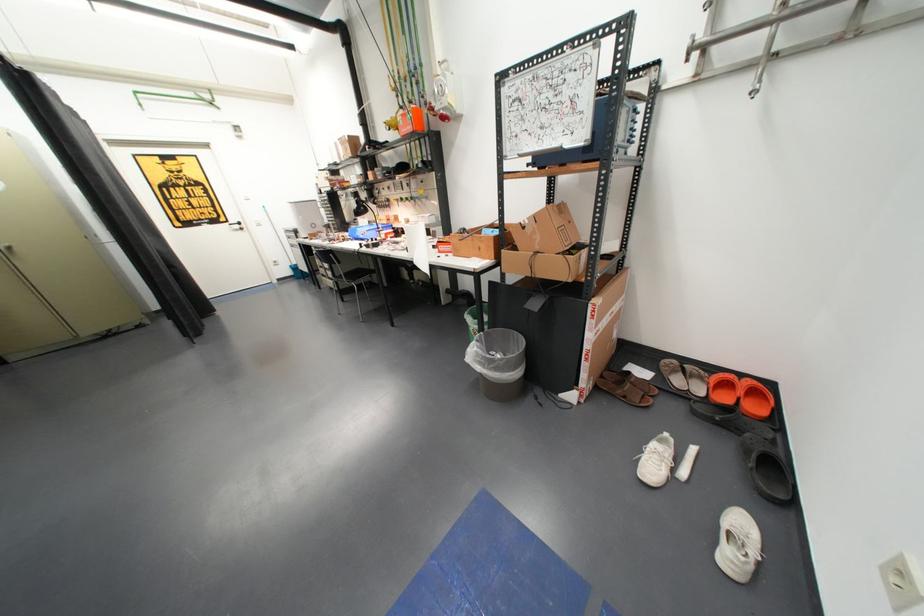
You are a GUI agent. You are given a task and a screenshot of the screen. Output one action in this format:
    pyautogui.click(x=<x>, y=<y>)
    Task: Click on the large cardboard box
    This screenshot has height=616, width=924.
    Given the screenshot: What is the action you would take?
    pyautogui.click(x=562, y=329)